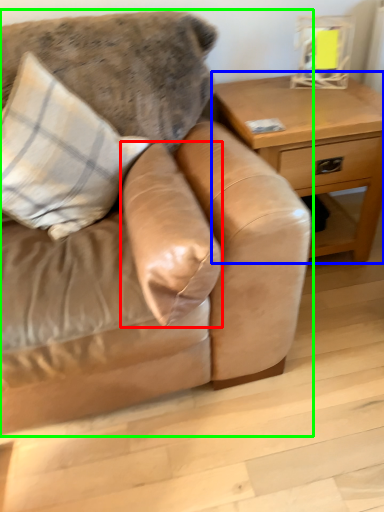
Question: Which object is positioned closest to pillow (highlighted by a red box)? Select from table (highlighted by a blue box) and studio couch (highlighted by a green box).

Choices:
 (A) table
 (B) studio couch

Answer: (B)